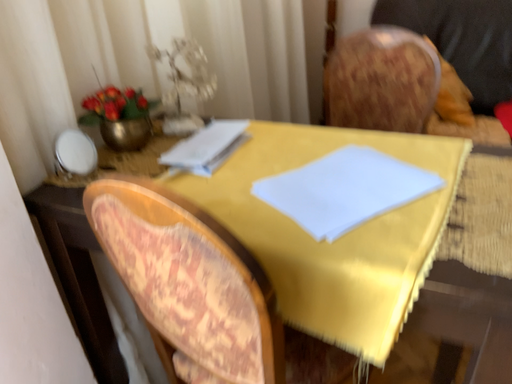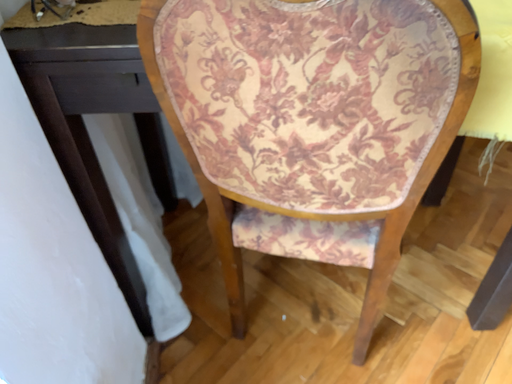
Question: How did the camera likely rotate when shooting the video?

Choices:
 (A) rotated upward
 (B) rotated downward

Answer: (B)